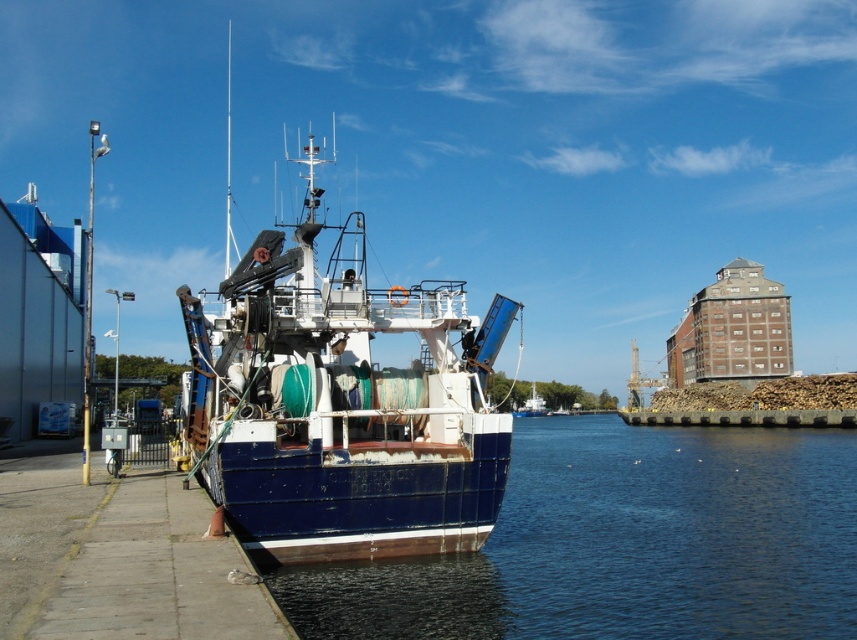
Question: Does blue water at lower left appear over blue painted wooden boat at center?

Choices:
 (A) yes
 (B) no

Answer: (A)

Question: Which of the following is the farthest from the observer?

Choices:
 (A) blue painted wooden boat at center
 (B) blue water at lower left

Answer: (A)

Question: Can you confirm if blue water at lower left is positioned above blue painted wooden boat at center?

Choices:
 (A) yes
 (B) no

Answer: (A)

Question: Does blue water at lower left come in front of blue painted wooden boat at center?

Choices:
 (A) no
 (B) yes

Answer: (B)